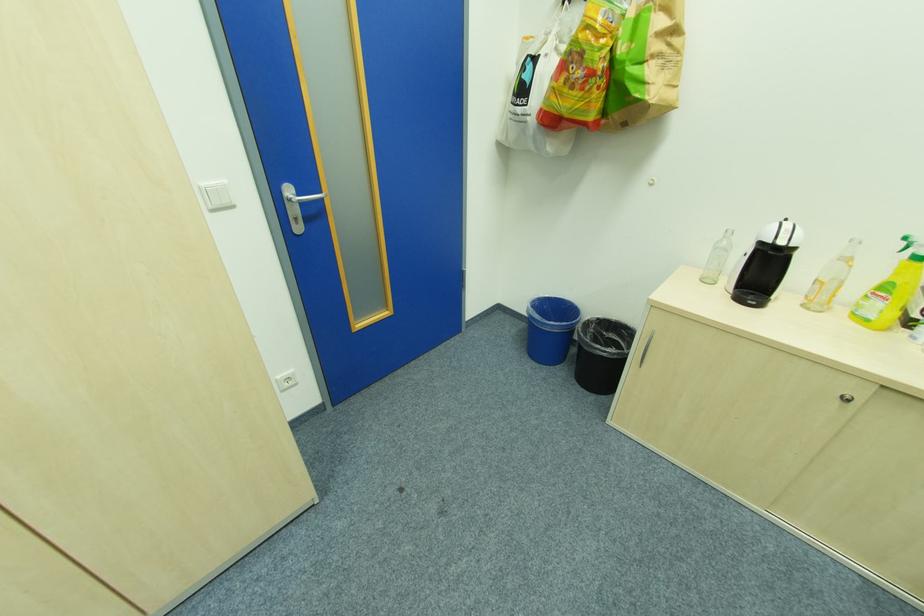
What do you see at coordinates (912, 244) in the screenshot? I see `a green spray trigger` at bounding box center [912, 244].